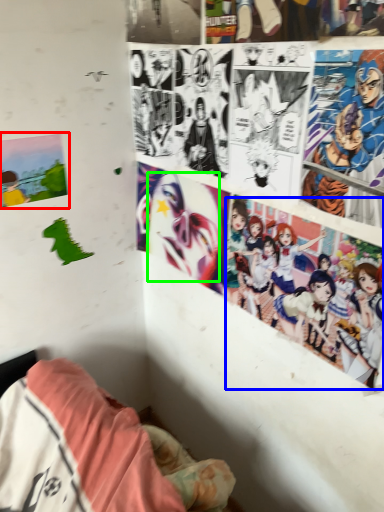
Question: Based on their relative distances, which object is farther from poster page (highlighted by a red box)? Choose from person (highlighted by a blue box) and human face (highlighted by a green box).

Choices:
 (A) person
 (B) human face

Answer: (A)